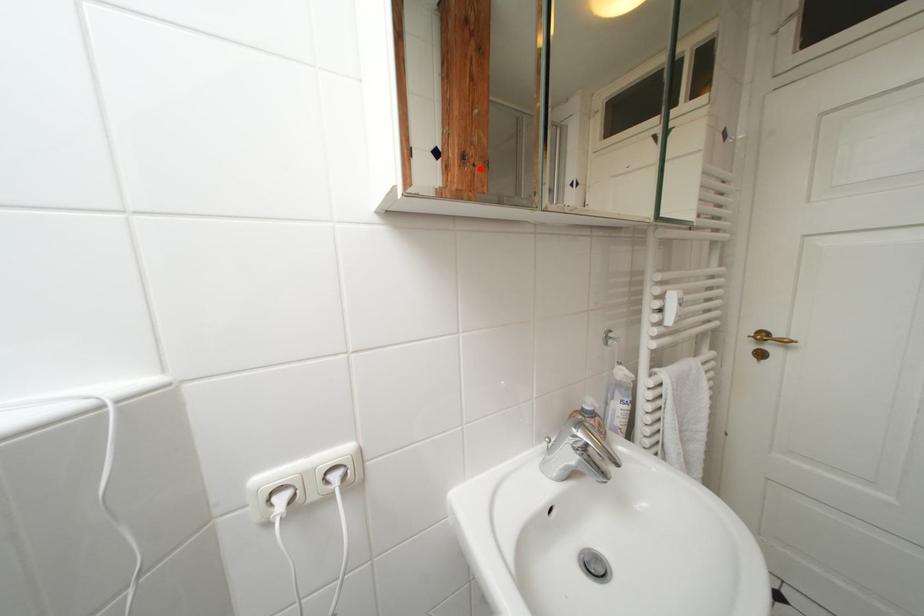
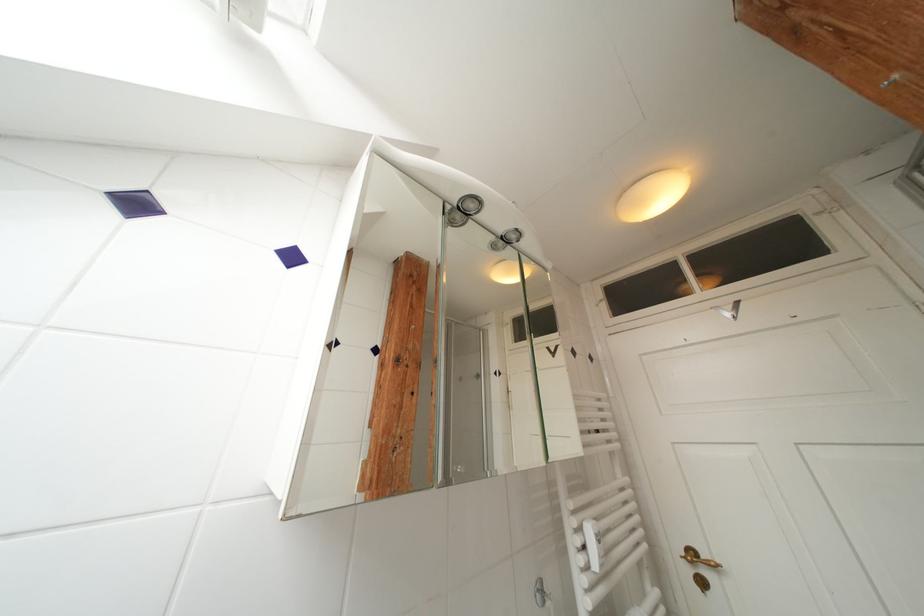
Question: A red point is marked in image1. In image2, is the corresponding 3D point closer to the camera or farther? Reply with the corresponding letter.

Choices:
 (A) The corresponding 3D point is closer.
 (B) The corresponding 3D point is farther.

Answer: (B)